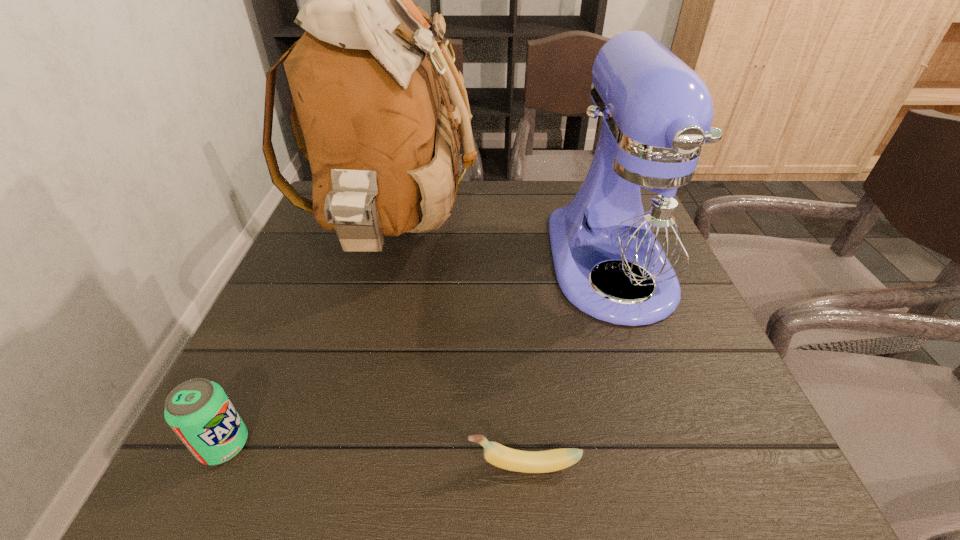
The image size is (960, 540). Find the location of `the tallest object`. the tallest object is located at coordinates 367,78.

Locate an element on the screen. the third shortest object is located at coordinates (640, 218).

At what (x,y) coordinates should I click in order to perform the action: click on the rightmost object. Please return your answer as a coordinate pair (x, y). The height and width of the screenshot is (540, 960). Looking at the image, I should click on (x=640, y=218).

This screenshot has width=960, height=540. Identify the location of the second shortest object. (198, 410).

This screenshot has width=960, height=540. I want to click on the shortest object, so click(x=496, y=454).

I want to click on vacant region located 0.320m on the front-facing side of the tallest object, so click(610, 234).

In order to click on free space located at the mixing area of the third shortest object in this screenshot , I will do `click(671, 436)`.

You are a GUI agent. You are given a task and a screenshot of the screen. Output one action in this format:
    pyautogui.click(x=<x>, y=<y>)
    Task: Click on the vacant space situated on the front-facing side of the pop soda
    This screenshot has height=540, width=960.
    Given the screenshot: What is the action you would take?
    coord(408,445)

Identify the location of vacant space located at the stem of the banana. (358, 466).

Where is `vacant space situated at the stem of the banana`? This screenshot has height=540, width=960. vacant space situated at the stem of the banana is located at coordinates (393, 466).